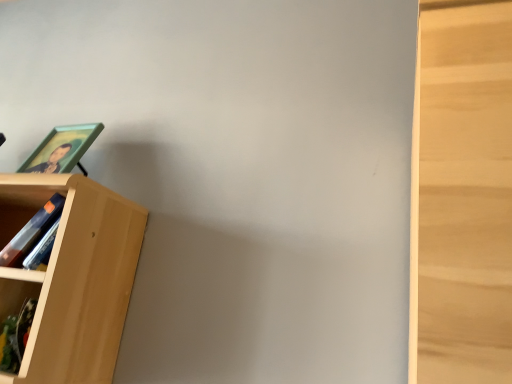
Question: Does light wood bookcase at left have a larger size compared to matte green picture frame at left?

Choices:
 (A) no
 (B) yes

Answer: (B)

Question: Is light wood bookcase at left outside of matte green picture frame at left?

Choices:
 (A) yes
 (B) no

Answer: (A)

Question: Is the surface of light wood bookcase at left in direct contact with matte green picture frame at left?

Choices:
 (A) yes
 (B) no

Answer: (B)

Question: Is light wood bookcase at left looking in the opposite direction of matte green picture frame at left?

Choices:
 (A) no
 (B) yes

Answer: (A)

Question: Can you confirm if light wood bookcase at left is positioned to the right of matte green picture frame at left?

Choices:
 (A) yes
 (B) no

Answer: (B)

Question: From the image's perspective, is light wood bookcase at left on matte green picture frame at left?

Choices:
 (A) yes
 (B) no

Answer: (B)

Question: Is matte green picture frame at left at the left side of light wood bookcase at left?

Choices:
 (A) yes
 (B) no

Answer: (B)

Question: Is matte green picture frame at left oriented towards light wood bookcase at left?

Choices:
 (A) no
 (B) yes

Answer: (A)

Question: Does matte green picture frame at left have a smaller size compared to light wood bookcase at left?

Choices:
 (A) no
 (B) yes

Answer: (B)

Question: From the image's perspective, is matte green picture frame at left on light wood bookcase at left?

Choices:
 (A) no
 (B) yes

Answer: (B)

Question: Considering the relative sizes of matte green picture frame at left and light wood bookcase at left in the image provided, is matte green picture frame at left taller than light wood bookcase at left?

Choices:
 (A) yes
 (B) no

Answer: (B)

Question: Would you consider matte green picture frame at left to be distant from light wood bookcase at left?

Choices:
 (A) yes
 (B) no

Answer: (B)

Question: In the image, is light wood bookcase at left on the left side or the right side of matte green picture frame at left?

Choices:
 (A) right
 (B) left

Answer: (B)